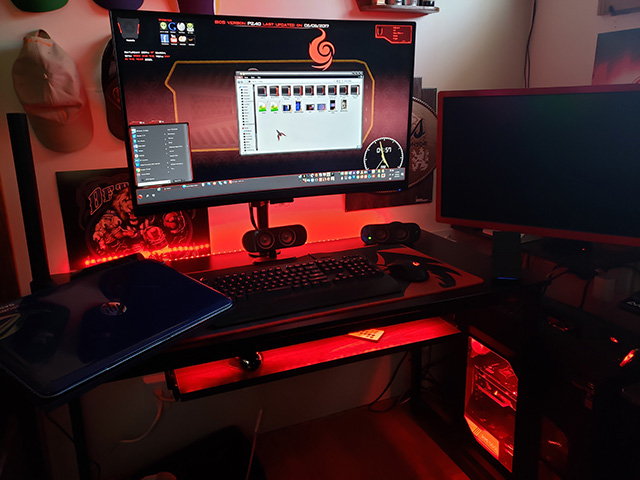
This screenshot has height=480, width=640. Identify the location of mouse. (413, 268), (251, 359).